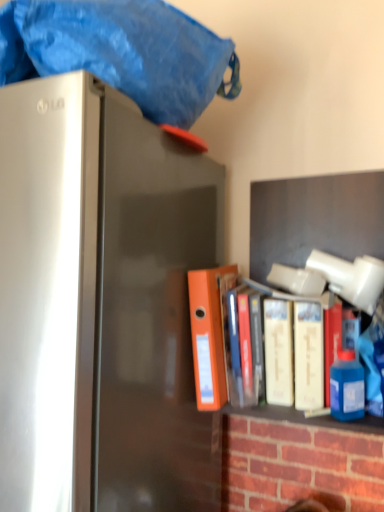
Question: From a real-world perspective, is white matte book at center, the 1th book viewed from the right, positioned over orange matte folder at center, which is counted as the first book, starting from the left, based on gravity?

Choices:
 (A) no
 (B) yes

Answer: (A)

Question: Considering the relative sizes of white matte book at center, which is counted as the second book, starting from the left, and orange matte folder at center, which is the 2th book in right-to-left order, in the image provided, is white matte book at center, which is counted as the second book, starting from the left, shorter than orange matte folder at center, which is the 2th book in right-to-left order,?

Choices:
 (A) no
 (B) yes

Answer: (B)

Question: Is white matte book at center, the 1th book viewed from the right, not within orange matte folder at center, which is counted as the first book, starting from the left?

Choices:
 (A) yes
 (B) no

Answer: (A)

Question: Considering the relative sizes of white matte book at center, the 1th book viewed from the right, and orange matte folder at center, which is the 2th book in right-to-left order, in the image provided, is white matte book at center, the 1th book viewed from the right, smaller than orange matte folder at center, which is the 2th book in right-to-left order,?

Choices:
 (A) yes
 (B) no

Answer: (B)

Question: From the image's perspective, is white matte book at center, the 1th book viewed from the right, above orange matte folder at center, which is the 2th book in right-to-left order?

Choices:
 (A) no
 (B) yes

Answer: (A)

Question: Does white matte book at center, the 1th book viewed from the right, have a greater width compared to orange matte folder at center, which is the 2th book in right-to-left order?

Choices:
 (A) yes
 (B) no

Answer: (B)

Question: Considering the relative sizes of orange matte folder at center, which is the 2th book in right-to-left order, and white matte book at center, the 1th book viewed from the right, in the image provided, is orange matte folder at center, which is the 2th book in right-to-left order, bigger than white matte book at center, the 1th book viewed from the right,?

Choices:
 (A) no
 (B) yes

Answer: (A)

Question: Is orange matte folder at center, which is the 2th book in right-to-left order, wider than white matte book at center, which is counted as the second book, starting from the left?

Choices:
 (A) no
 (B) yes

Answer: (B)

Question: Is orange matte folder at center, which is counted as the first book, starting from the left, to the right of white matte book at center, which is counted as the second book, starting from the left, from the viewer's perspective?

Choices:
 (A) yes
 (B) no

Answer: (B)

Question: Is orange matte folder at center, which is the 2th book in right-to-left order, located outside white matte book at center, which is counted as the second book, starting from the left?

Choices:
 (A) no
 (B) yes

Answer: (B)

Question: From a real-world perspective, is orange matte folder at center, which is counted as the first book, starting from the left, located higher than white matte book at center, the 1th book viewed from the right?

Choices:
 (A) no
 (B) yes

Answer: (B)

Question: Does orange matte folder at center, which is counted as the first book, starting from the left, come in front of white matte book at center, which is counted as the second book, starting from the left?

Choices:
 (A) yes
 (B) no

Answer: (B)

Question: Is orange matte folder at center, which is counted as the first book, starting from the left, at the back of satin silver refrigerator at left?

Choices:
 (A) no
 (B) yes

Answer: (A)